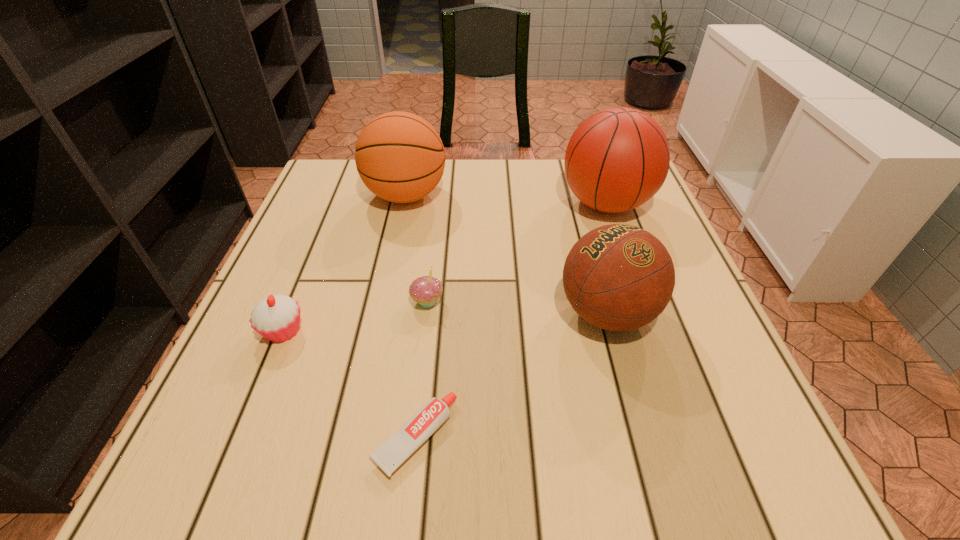
The height and width of the screenshot is (540, 960). Identify the location of vacant space situated on the right of the nearest object. (528, 437).

Find the location of `object positioned at the near edge`. object positioned at the near edge is located at coordinates (416, 430).

At what (x,y) coordinates should I click in order to perform the action: click on basketball at the left edge. Please return your answer as a coordinate pair (x, y). The height and width of the screenshot is (540, 960). Looking at the image, I should click on (400, 157).

You are a GUI agent. You are given a task and a screenshot of the screen. Output one action in this format:
    pyautogui.click(x=<x>, y=<y>)
    Task: Click on the cupcake that is positioned at the left edge
    Image resolution: width=960 pixels, height=540 pixels.
    Given the screenshot: What is the action you would take?
    pyautogui.click(x=277, y=317)

Where is `object positioned at the far left corner`? The image size is (960, 540). object positioned at the far left corner is located at coordinates (400, 157).

At what (x,y) coordinates should I click in order to perform the action: click on object present at the far right corner. Please return your answer as a coordinate pair (x, y). Looking at the image, I should click on (617, 159).

The height and width of the screenshot is (540, 960). What are the coordinates of `free space at the far edge` in the screenshot? It's located at (488, 165).

This screenshot has height=540, width=960. Find the location of `free region at the left edge`. free region at the left edge is located at coordinates (260, 399).

The image size is (960, 540). Identify the location of vacant space at the right edge. (660, 227).

In the image, there is a desktop. Where is `free space at the far left corner`? free space at the far left corner is located at coordinates (351, 184).